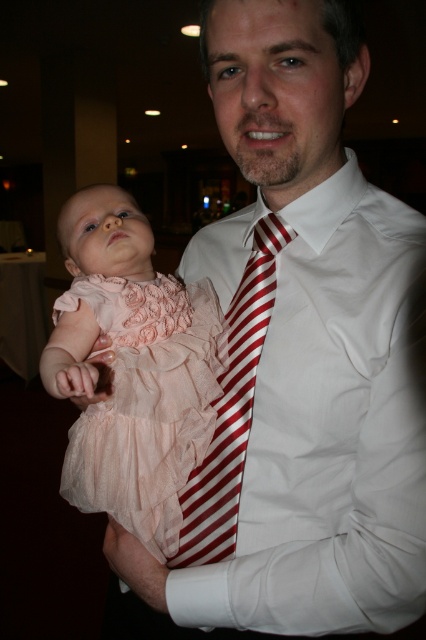
Which is above, red striped tie at center or pink satin dress at left?

pink satin dress at left

Does red striped tie at center appear under pink satin dress at left?

Yes, red striped tie at center is below pink satin dress at left.

You are a GUI agent. You are given a task and a screenshot of the screen. Output one action in this format:
    pyautogui.click(x=<x>, y=<y>)
    Task: Click on the red striped tie at center
    
    Given the screenshot: What is the action you would take?
    pyautogui.click(x=232, y=408)

Identify the location of red striped tie at center. (232, 408).

Does pale pink chiffon dress at center have a smaller size compared to red striped tie at center?

Incorrect, pale pink chiffon dress at center is not smaller in size than red striped tie at center.

This screenshot has width=426, height=640. Identify the location of pale pink chiffon dress at center. (132, 369).

Does pale pink chiffon dress at center appear on the right side of pink satin dress at left?

Indeed, pale pink chiffon dress at center is positioned on the right side of pink satin dress at left.

Is point (176, 528) farther from viewer compared to point (74, 332)?

Yes, it is behind point (74, 332).

Which is behind, point (152, 550) or point (103, 396)?

The point (152, 550) is behind.

Find the location of `pale pink chiffon dress at center`. pale pink chiffon dress at center is located at coordinates (132, 369).